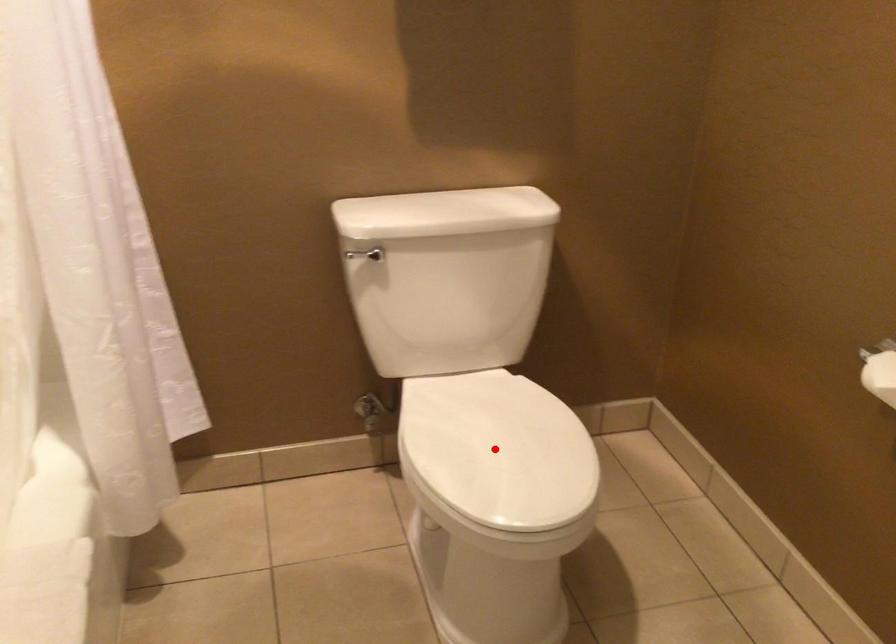
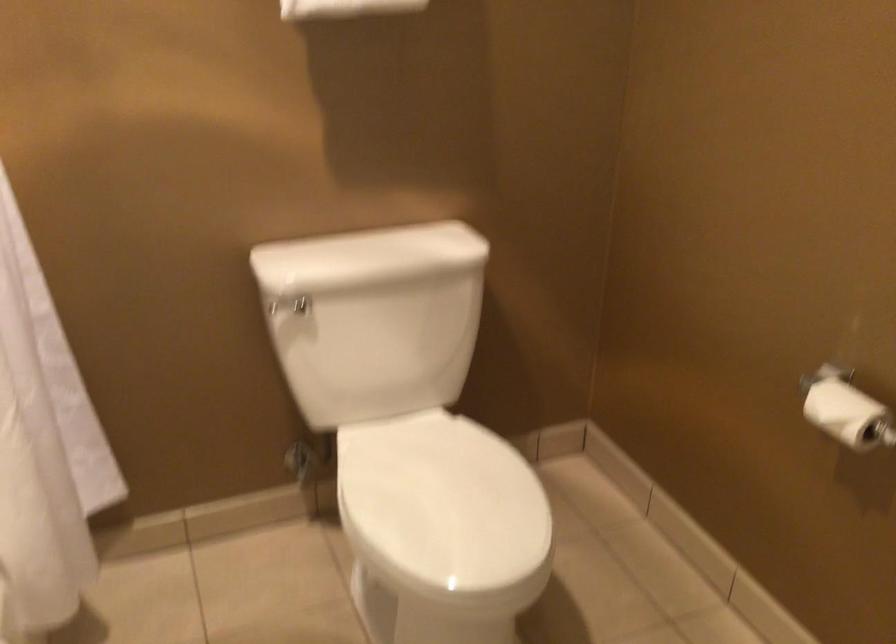
Question: I am providing you with two images of the same scene from different viewpoints. A red point is marked on the first image. Can you still see the location of the red point in image 2?

Choices:
 (A) Yes
 (B) No

Answer: (A)